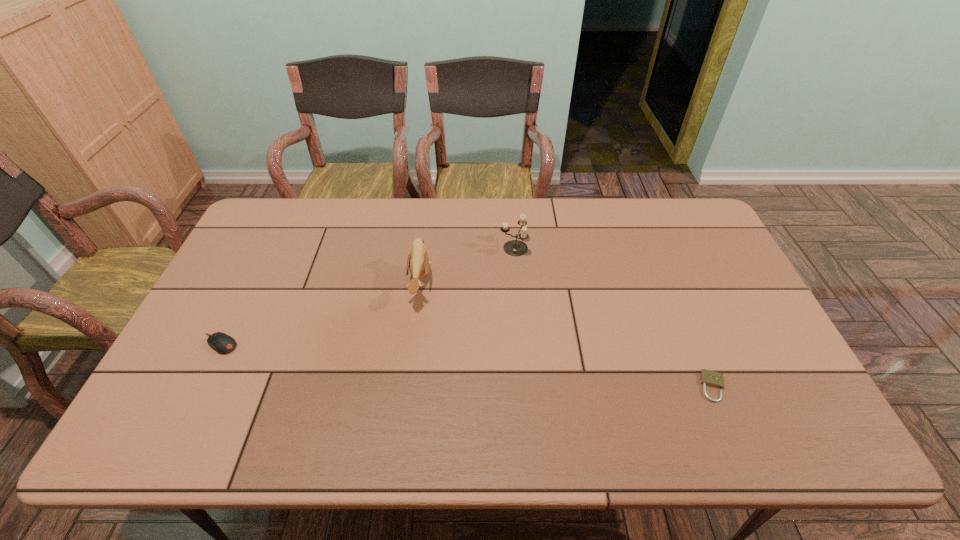
Locate an element on the screen. vacant point located between the candle holder and the rightmost object is located at coordinates (613, 317).

The image size is (960, 540). I want to click on blank region between the shortest object and the leftmost object, so click(x=467, y=365).

At what (x,y) coordinates should I click in order to perform the action: click on vacant region between the second object from right to left and the third farthest object. Please return your answer as a coordinate pair (x, y). Looking at the image, I should click on (367, 296).

Identify the location of vacant space that is in between the second object from left to right and the third object from left to right. The height and width of the screenshot is (540, 960). click(467, 266).

Image resolution: width=960 pixels, height=540 pixels. Identify the location of empty space between the computer mouse and the bird. (320, 314).

The image size is (960, 540). Identify the location of free space that is in between the leftmost object and the candle holder. (367, 296).

Locate an element on the screen. The width and height of the screenshot is (960, 540). vacant space that's between the second object from left to right and the computer mouse is located at coordinates (320, 314).

Where is `the third closest object to the nearest object`? The width and height of the screenshot is (960, 540). the third closest object to the nearest object is located at coordinates pyautogui.click(x=222, y=343).

Where is `object that can be found as the third closest to the second object from left to right`? This screenshot has height=540, width=960. object that can be found as the third closest to the second object from left to right is located at coordinates (711, 378).

This screenshot has width=960, height=540. I want to click on free space that satisfies the following two spatial constraints: 1. at the beak of the bird; 2. on the front side of the second nearest object, so click(412, 344).